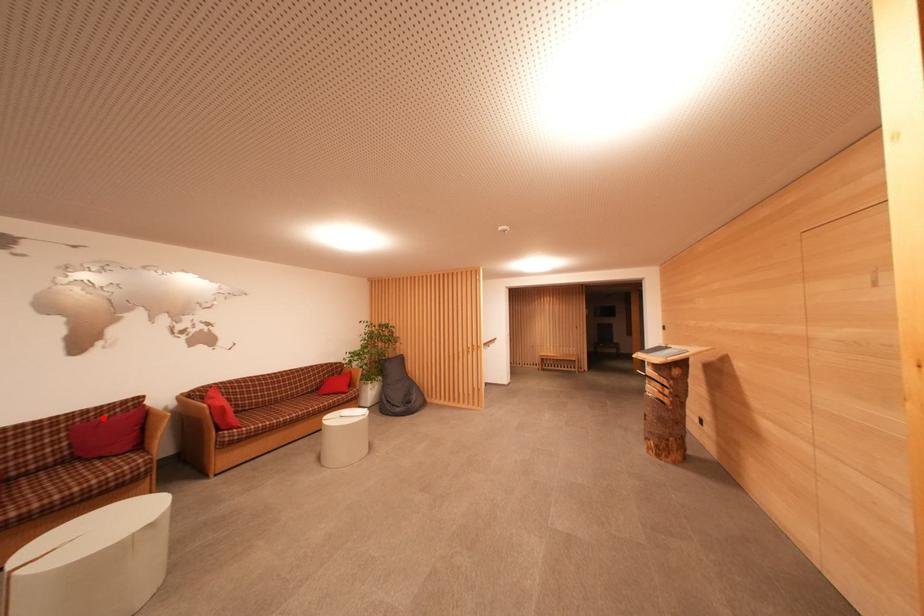
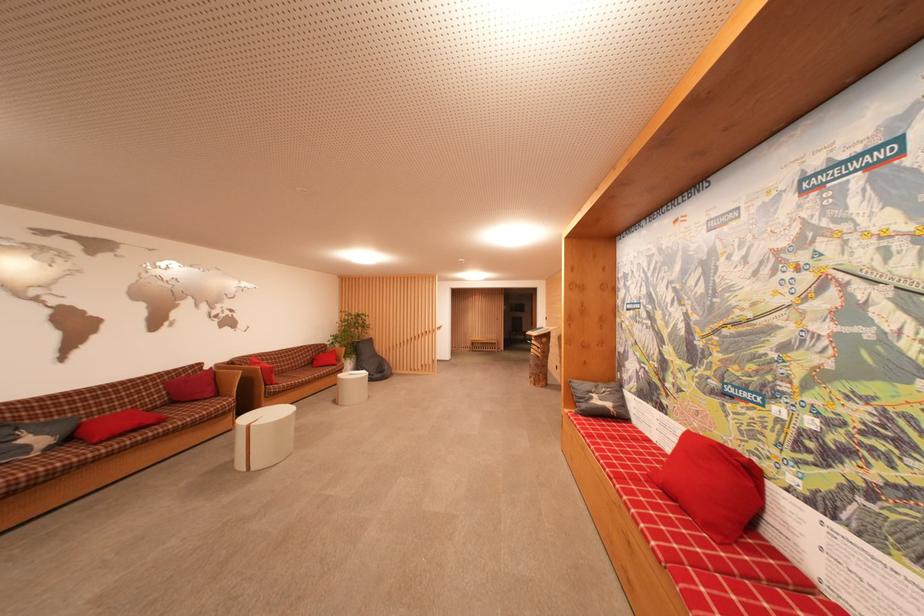
Locate, in the second image, the point that corresponds to the highlighted location in the first image.

(183, 378)